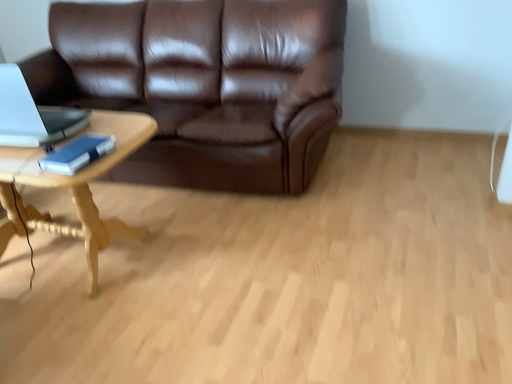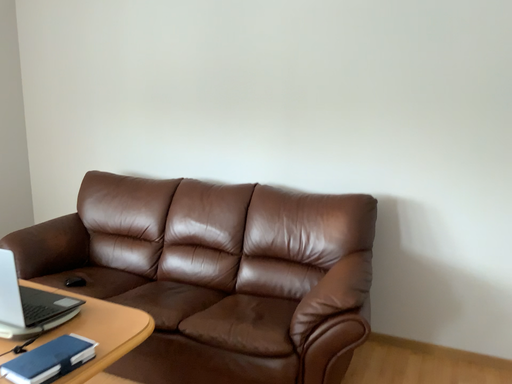
Question: How did the camera likely rotate when shooting the video?

Choices:
 (A) rotated downward
 (B) rotated upward

Answer: (B)